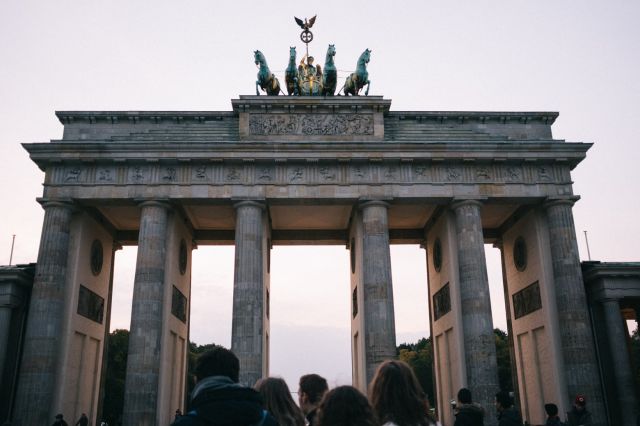
Find the location of a particular element. This screenshot has height=426, width=640. pillar is located at coordinates (250, 299).